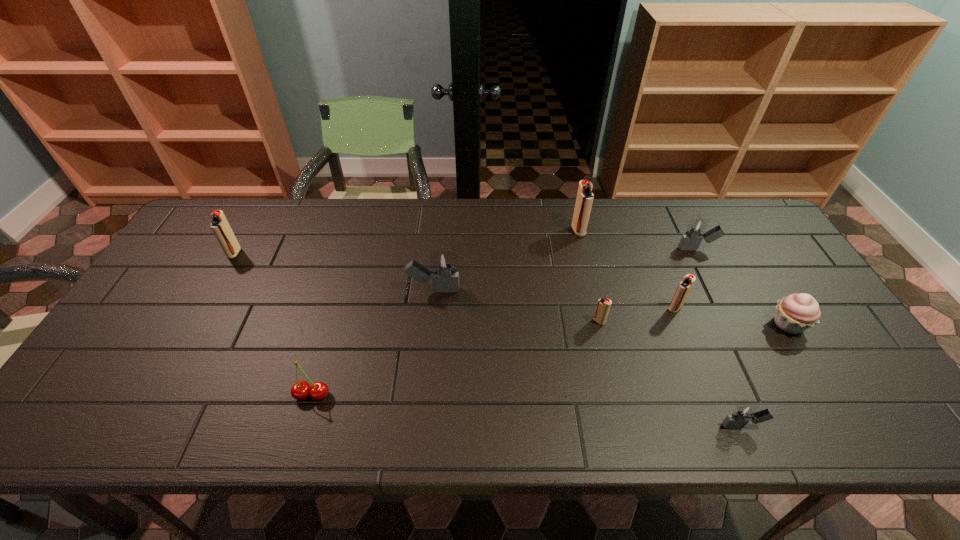
Where is `free space between the nearest gray igniter and the second nearest igniter`? The height and width of the screenshot is (540, 960). free space between the nearest gray igniter and the second nearest igniter is located at coordinates (671, 374).

I want to click on free space between the farthest gray igniter and the third object from left to right, so click(x=565, y=269).

The height and width of the screenshot is (540, 960). What are the coordinates of `free space between the second nearest object and the cupcake` in the screenshot? It's located at (550, 360).

Identify the location of free spot between the nearest object and the tallest object. Image resolution: width=960 pixels, height=540 pixels. (660, 328).

Identify which object is the closest to the second object from left to right. Please provide its 2D coordinates. Your answer should be formatted as a tuple, i.e. [(x, y)], where the tuple contains the x and y coordinates of a point satisfying the conditions above.

[(446, 280)]

Identify which object is the fourth closest to the red cherry. Please provide its 2D coordinates. Your answer should be formatted as a tuple, i.e. [(x, y)], where the tuple contains the x and y coordinates of a point satisfying the conditions above.

[(585, 197)]

The image size is (960, 540). I want to click on igniter that is the second closest to the red cherry, so click(219, 224).

Where is `igniter that is the fifth nearest to the pink cupcake`? igniter that is the fifth nearest to the pink cupcake is located at coordinates (585, 197).

Where is `the third closest red igniter to the leftmost igniter`? The height and width of the screenshot is (540, 960). the third closest red igniter to the leftmost igniter is located at coordinates (685, 286).

Where is `the fourth closest red igniter relative to the second biggest gray igniter`? The width and height of the screenshot is (960, 540). the fourth closest red igniter relative to the second biggest gray igniter is located at coordinates click(219, 224).